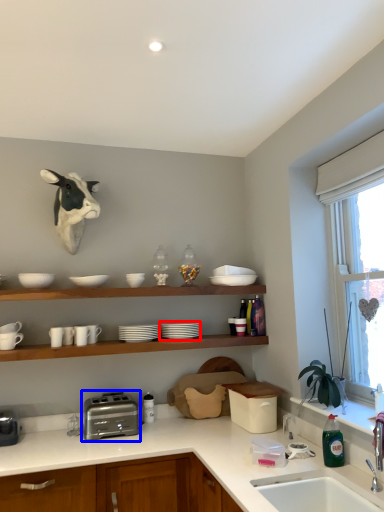
Question: Which point is closer to the camera, tableware (highlighted by a red box) or toaster (highlighted by a blue box)?

Choices:
 (A) tableware
 (B) toaster

Answer: (B)